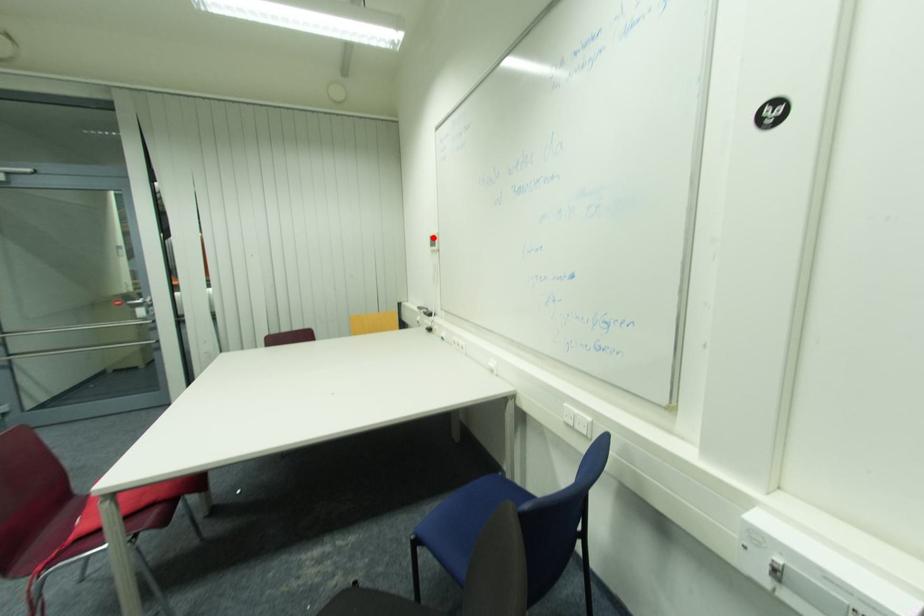
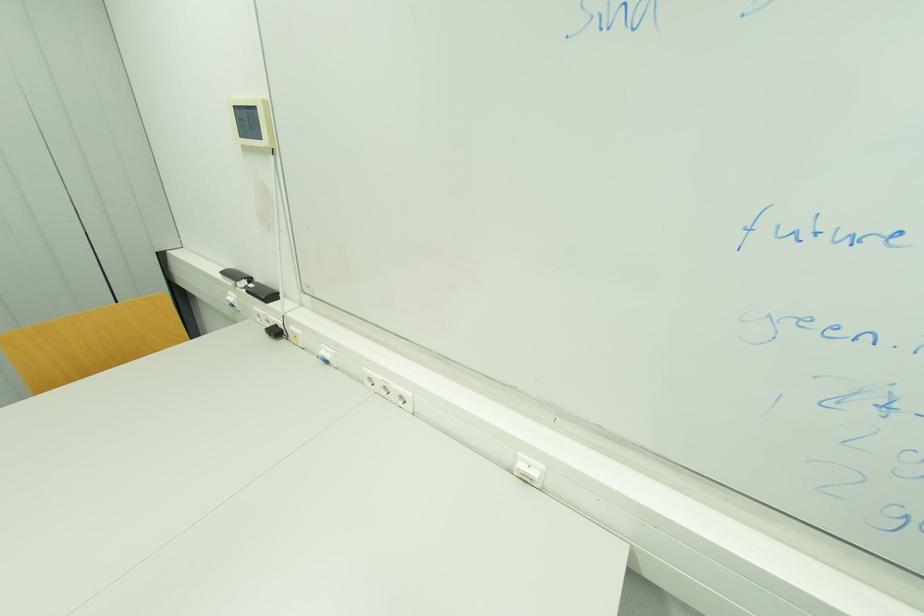
Find the pixel in the second image that matches the highlighted location in the first image.

(237, 108)